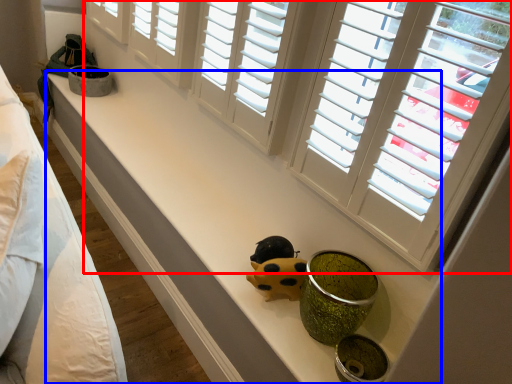
Question: Which object is further to the camera taking this photo, window (highlighted by a red box) or counter top (highlighted by a blue box)?

Choices:
 (A) window
 (B) counter top

Answer: (B)